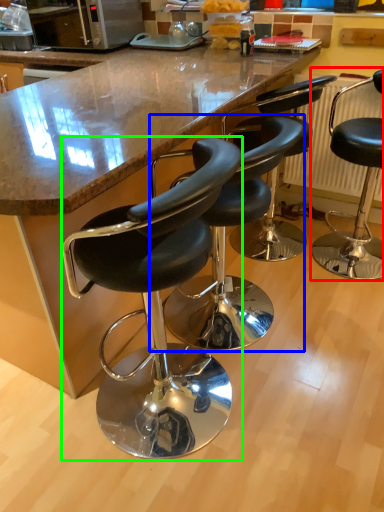
Question: Considering the real-world distances, which object is closest to chair (highlighted by a red box)? chair (highlighted by a blue box) or chair (highlighted by a green box).

Choices:
 (A) chair
 (B) chair

Answer: (A)